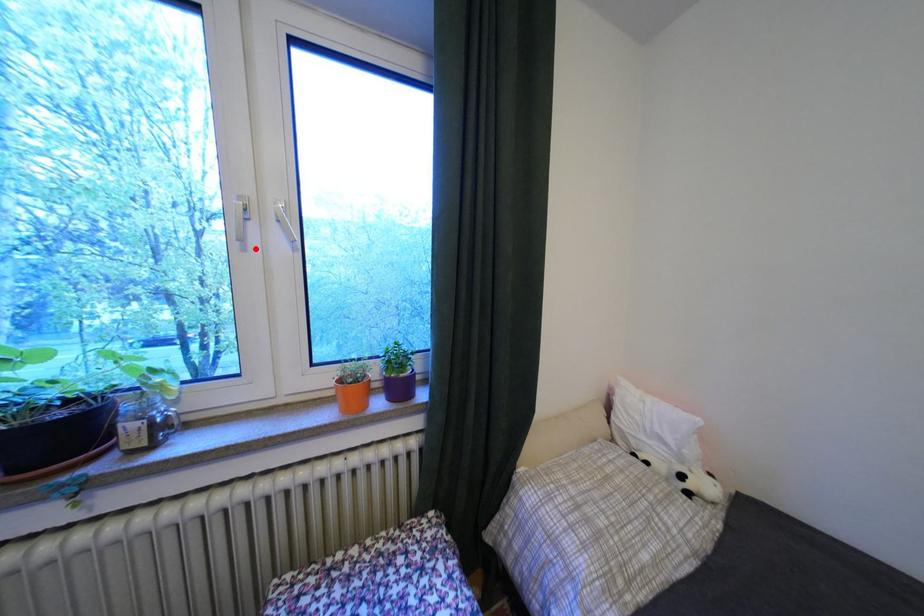
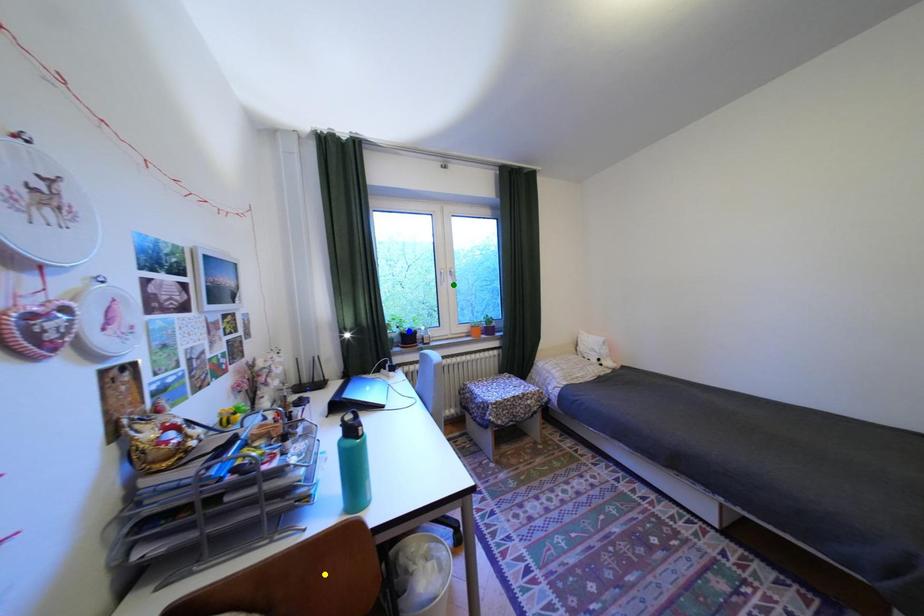
Question: I am providing you with two images of the same scene from different viewpoints. A red point is marked on the first image. You are given multiple points on the second image. Which spot in image 2 lines up with the point in image 1?

Choices:
 (A) yellow point
 (B) green point
 (C) blue point

Answer: (B)